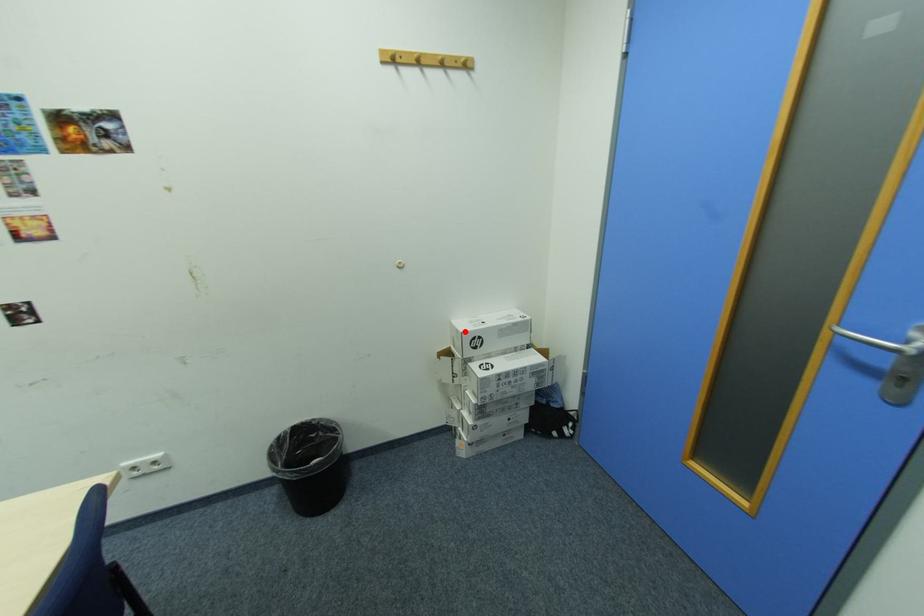
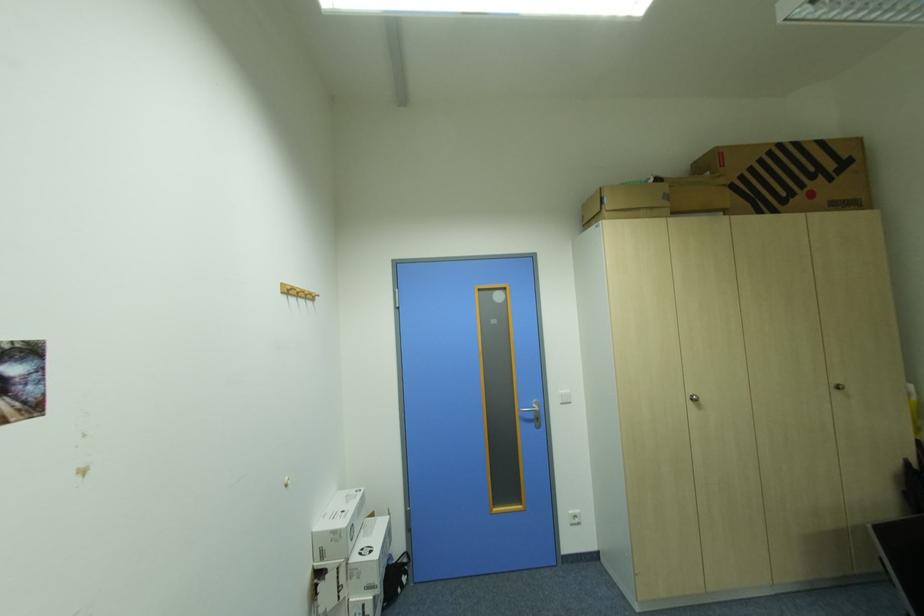
Where in the second image is the point corresponding to the highlighted location from the first image?

(341, 533)